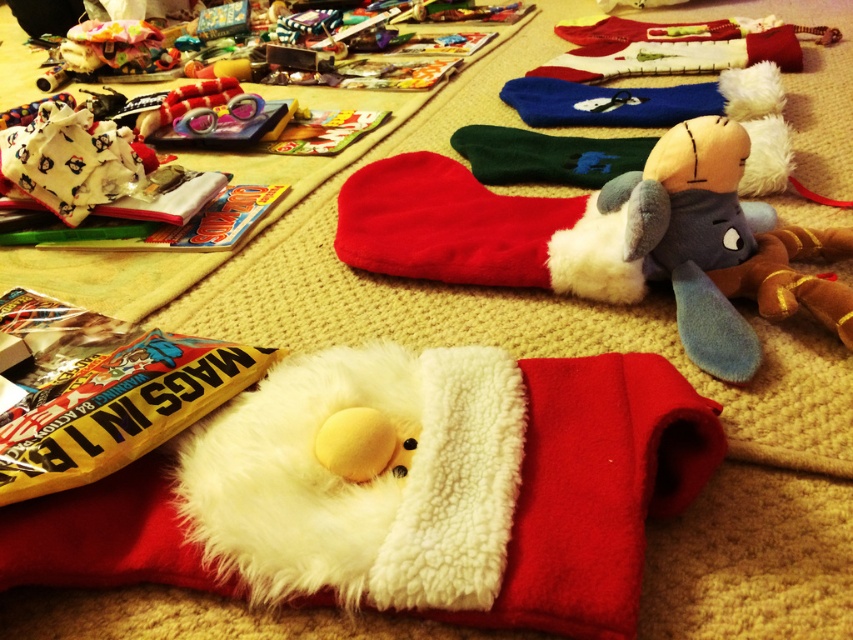
Question: Which point appears farthest from the camera in this image?

Choices:
 (A) (390, 188)
 (B) (766, 276)

Answer: (A)

Question: Is blue plush toy at upper right positioned behind red plush sock at center?

Choices:
 (A) yes
 (B) no

Answer: (B)

Question: Can you confirm if blue plush toy at upper right is smaller than red plush sock at center?

Choices:
 (A) no
 (B) yes

Answer: (B)

Question: Does blue plush toy at upper right have a smaller size compared to red plush sock at center?

Choices:
 (A) yes
 (B) no

Answer: (A)

Question: Which point is farther from the camera taking this photo?

Choices:
 (A) (720, 161)
 (B) (523, 196)

Answer: (B)

Question: Which point is closer to the camera?

Choices:
 (A) (595, 216)
 (B) (631, 244)

Answer: (B)